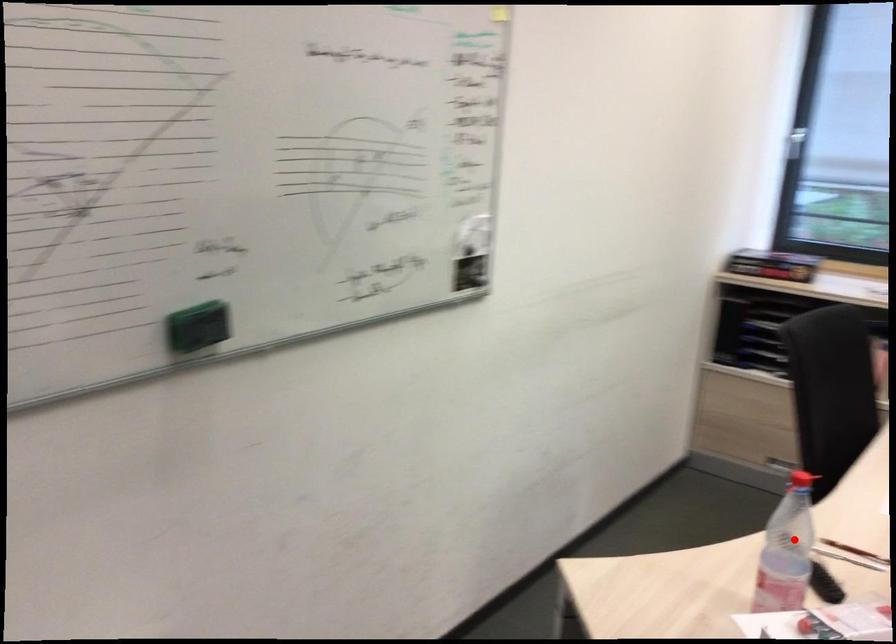
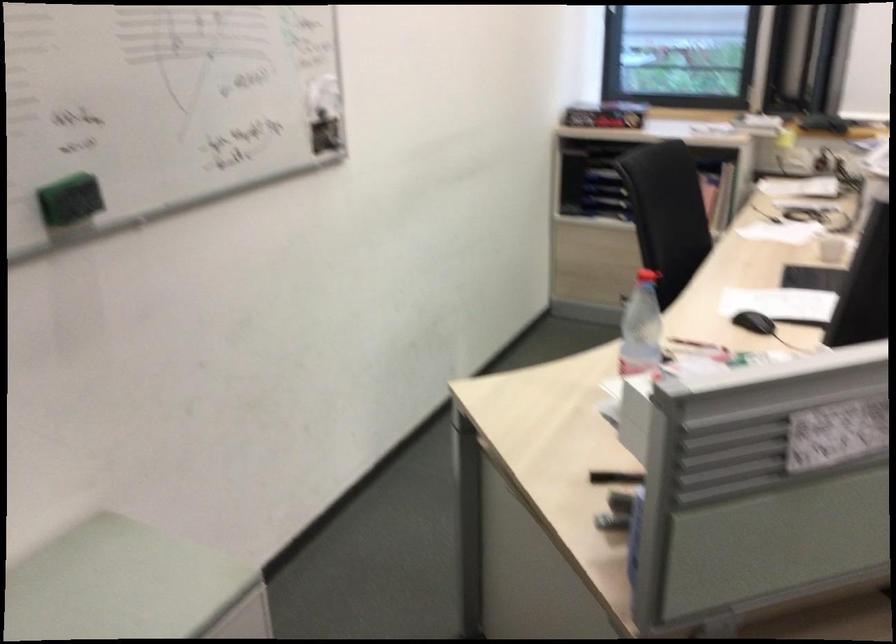
Locate, in the second image, the point that corresponds to the highlighted location in the first image.

(641, 327)